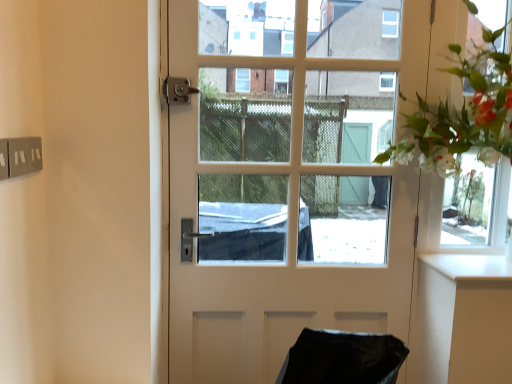
Question: Is clear glass window frame at upper right to the left or to the right of white glossy counter top at right in the image?

Choices:
 (A) left
 (B) right

Answer: (B)

Question: In the image, is clear glass window frame at upper right positioned in front of or behind white glossy counter top at right?

Choices:
 (A) behind
 (B) front

Answer: (A)

Question: Which of these objects is positioned closest to the white glossy door at center?

Choices:
 (A) clear glass window frame at upper right
 (B) white glossy counter top at right

Answer: (A)

Question: Which object is positioned closest to the clear glass window frame at upper right?

Choices:
 (A) white glossy door at center
 (B) white glossy counter top at right

Answer: (B)